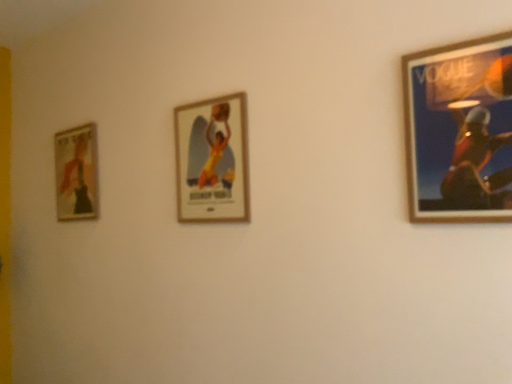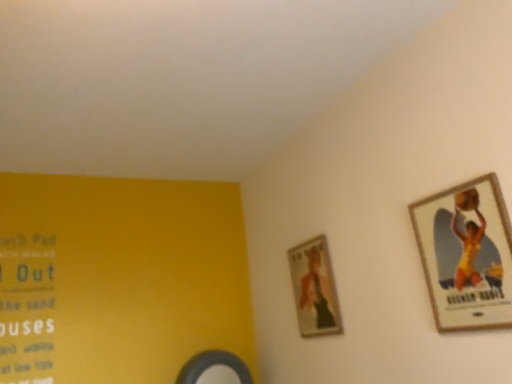
Question: Which way did the camera rotate in the video?

Choices:
 (A) rotated left
 (B) rotated right

Answer: (A)